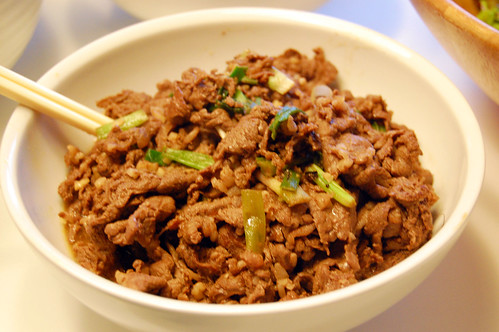
Where is `bowl rim`? This screenshot has width=499, height=332. bowl rim is located at coordinates (113, 39), (50, 255), (404, 267), (395, 49).